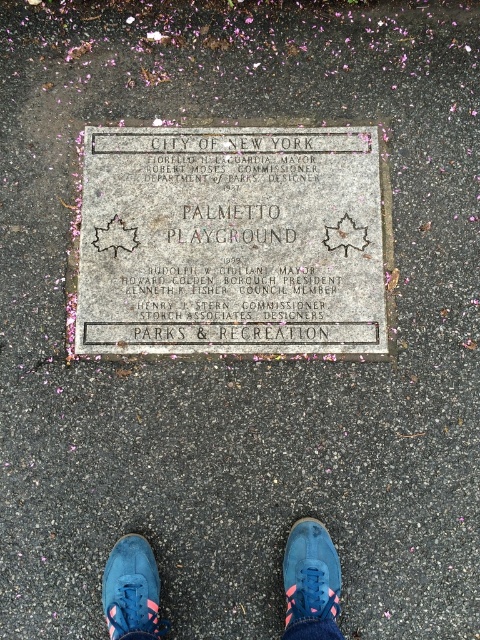
Question: Considering the relative positions of gray concrete plaque at center and blue suede shoes at center in the image provided, where is gray concrete plaque at center located with respect to blue suede shoes at center?

Choices:
 (A) below
 (B) above

Answer: (B)

Question: Among these points, which one is farthest from the camera?

Choices:
 (A) (116, 310)
 (B) (312, 582)
 (C) (335, 582)
 (D) (122, 577)

Answer: (A)

Question: Is gray concrete plaque at center smaller than blue suede shoe at center?

Choices:
 (A) yes
 (B) no

Answer: (B)

Question: Which object is the closest to the blue suede shoes at center?

Choices:
 (A) gray concrete plaque at center
 (B) blue suede shoe at lower center
 (C) blue suede shoe at center

Answer: (C)

Question: Which point is closer to the camera taking this photo?

Choices:
 (A) 316,172
 (B) 122,580
 (C) 324,605

Answer: (C)

Question: Can you confirm if blue suede shoe at lower center is bigger than blue suede shoe at center?

Choices:
 (A) yes
 (B) no

Answer: (A)